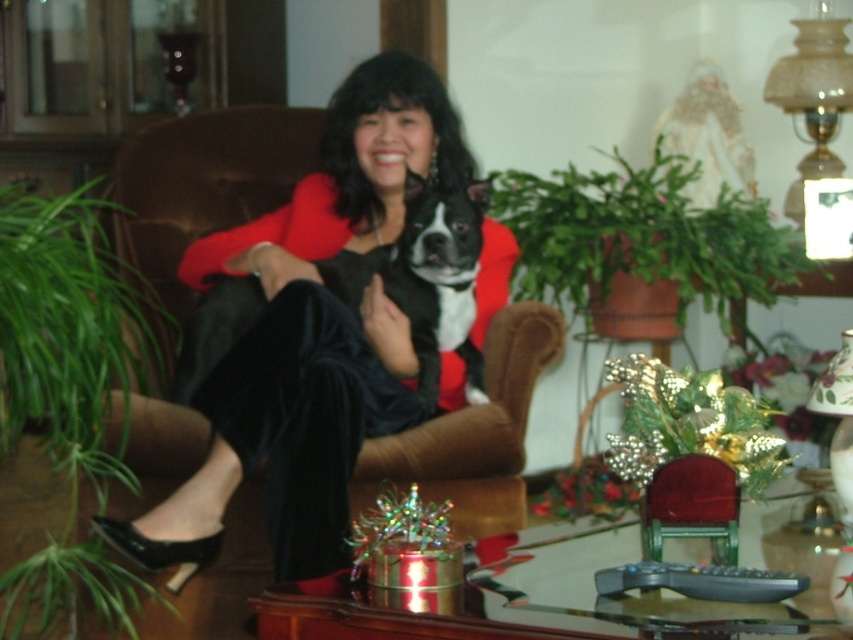
Question: Does velvet black dress at center have a greater width compared to black and white fur at center?

Choices:
 (A) no
 (B) yes

Answer: (B)

Question: Can you confirm if velvet black dress at center is wider than black and white fur at center?

Choices:
 (A) no
 (B) yes

Answer: (B)

Question: Which of the following is the closest to the observer?

Choices:
 (A) (421, 308)
 (B) (448, 228)

Answer: (B)

Question: Which object appears closest to the camera in this image?

Choices:
 (A) velvet black dress at center
 (B) black and white fur at center

Answer: (A)

Question: Is velvet black dress at center closer to camera compared to black and white fur at center?

Choices:
 (A) yes
 (B) no

Answer: (A)